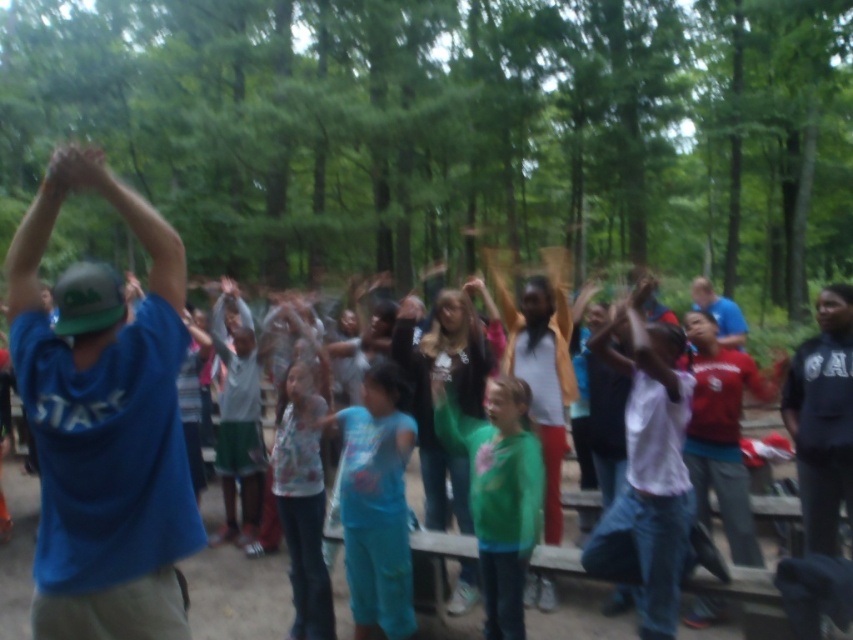
You are standing at the origin point in the forest scene. The white matte shirt at center is at coordinates 0.741, 0.761. If you walk directly towards the shirt, will you encounter any obstacles between you and the shirt?

The white matte shirt at center is located at point [648,474], but there is no information provided about obstacles between the origin and the shirt. Therefore, it is impossible to determine if there are obstacles in the way.